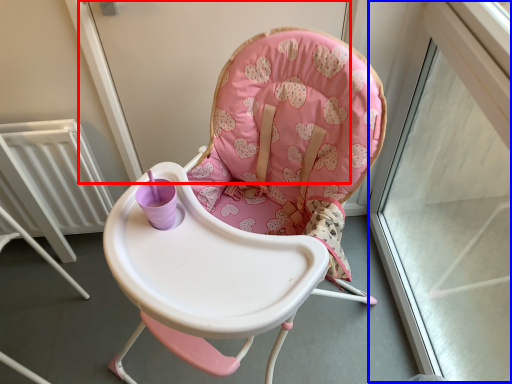
Question: Which object appears farthest to the camera in this image, screen door (highlighted by a red box) or window frame (highlighted by a blue box)?

Choices:
 (A) screen door
 (B) window frame

Answer: (A)